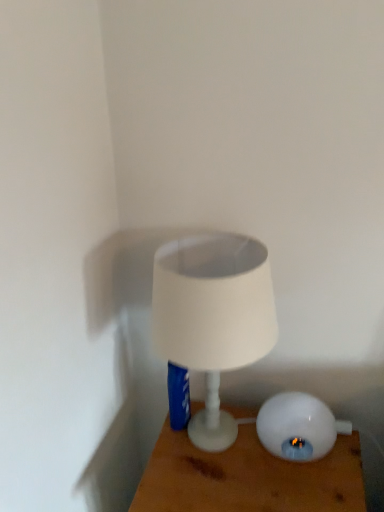
Locate an element on the screen. vacant area situated below white matte lampshade at center, acting as the first lamp starting from the left (from a real-world perspective) is located at coordinates point(209,448).